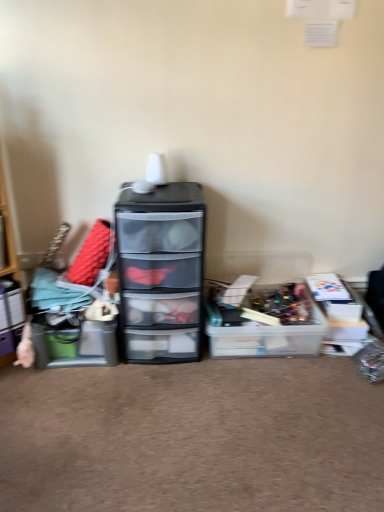
Question: Do you think transparent plastic chest of drawers at center is within matte plastic storage box at left, the third storage box viewed from the right, or outside of it?

Choices:
 (A) inside
 (B) outside

Answer: (B)

Question: From a real-world perspective, relative to matte plastic storage box at left, which is the 1th storage box from left to right, is transparent plastic chest of drawers at center vertically above or below?

Choices:
 (A) above
 (B) below

Answer: (A)

Question: Based on their relative distances, which object is farther from the matte plastic storage box at left, the 2th storage box positioned from the right?

Choices:
 (A) matte plastic storage box at left, the third storage box viewed from the right
 (B) wooden shelf at left
 (C) transparent plastic chest of drawers at center
 (D) translucent plastic storage box at center, which is the 1th storage box in right-to-left order

Answer: (D)

Question: Which of these objects is positioned farthest from the wooden shelf at left?

Choices:
 (A) matte plastic storage box at left, the 2th storage box positioned from the left
 (B) translucent plastic storage box at center, which is the 1th storage box in right-to-left order
 (C) matte plastic storage box at left, the third storage box viewed from the right
 (D) transparent plastic chest of drawers at center

Answer: (B)